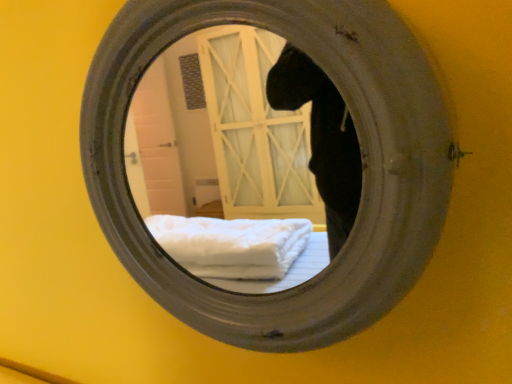
Describe the element at coordinates (362, 155) in the screenshot. The height and width of the screenshot is (384, 512). I see `smooth gray porthole at center` at that location.

Measure the distance between smooth gray porthole at center and camera.

smooth gray porthole at center and camera are 12.57 inches apart.

The height and width of the screenshot is (384, 512). What are the coordinates of `smooth gray porthole at center` in the screenshot? It's located at (362, 155).

Image resolution: width=512 pixels, height=384 pixels. Find the location of `smooth gray porthole at center`. smooth gray porthole at center is located at coordinates (362, 155).